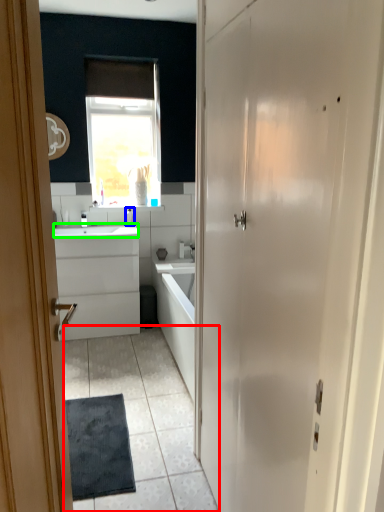
Question: Based on their relative distances, which object is nearer to plain (highlighted by a red box)? Choose from toiletry (highlighted by a blue box) and counter top (highlighted by a green box).

Choices:
 (A) toiletry
 (B) counter top

Answer: (B)